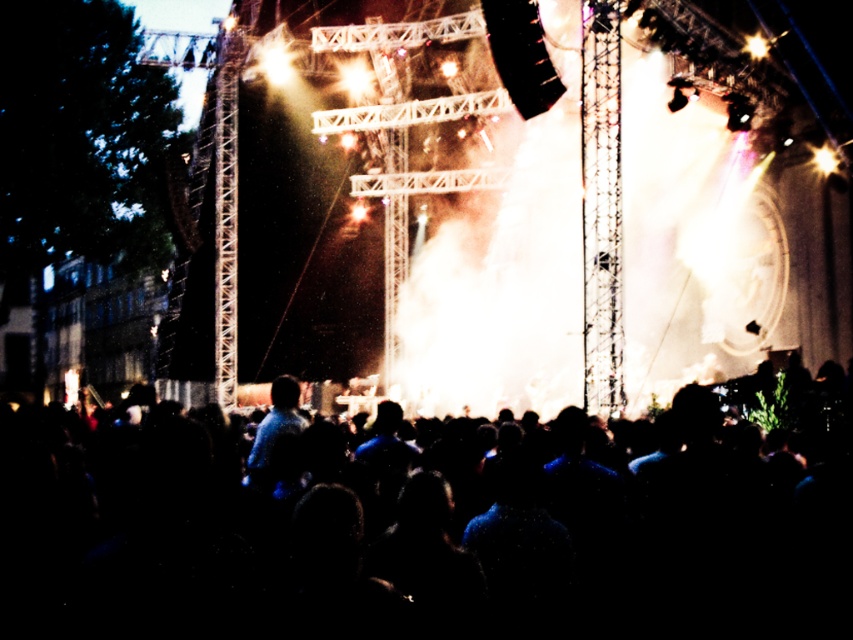
A drone operator is flying a drone that can travel 300 feet away from its starting position. The operator is currently at the point marked as point (338, 556). Can the drone reach the stage lights without exceeding its maximum range?

The distance between point (338, 556) and the stage lights is 278.18 feet, which is within the drone operator maximum range of 300 feet. Therefore, the drone can reach the stage lights without exceeding its maximum range.

You are a photographer positioned at the edge of the stage, aiming to capture a photo of the blue fabric shirt at center without the black matte crowd at center blocking the view. Is this possible given their positions?

The black matte crowd at center is closer to the viewer than the blue fabric shirt at center, so the crowd would block the view of the shirt. It is not possible to capture the shirt without the crowd blocking it.

You are a stagehand standing behind the blue fabric shirt at center. You need to adjust a spotlight that is currently blocked by the black matte crowd at center. Can you see over the crowd to aim the light properly?

The black matte crowd at center has a greater height compared to the blue fabric shirt at center, so the crowd is taller than you. This means you might not be able to see over them to adjust the spotlight properly.